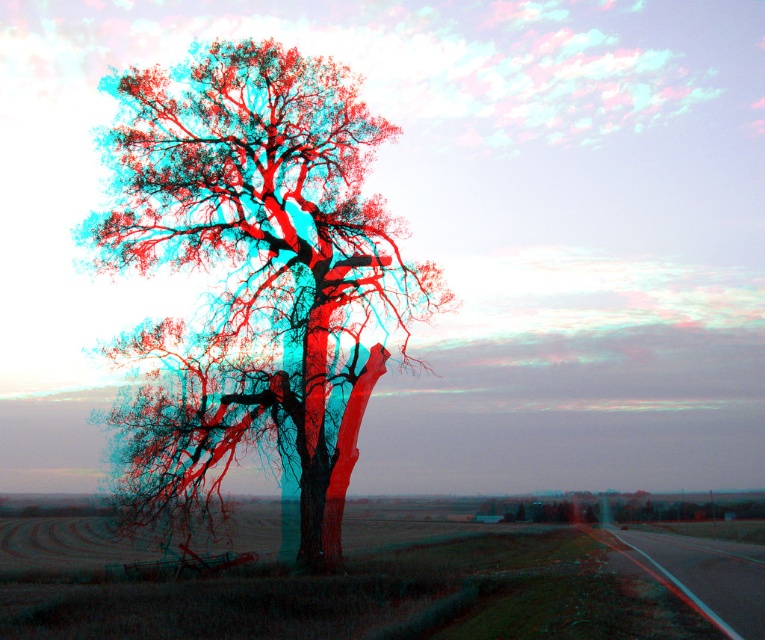
Question: Which point appears farthest from the camera in this image?

Choices:
 (A) pos(757,586)
 (B) pos(330,532)

Answer: (B)

Question: Where is smooth bark tree at center located in relation to black asphalt highway at lower right in the image?

Choices:
 (A) right
 (B) left

Answer: (B)

Question: Which of the following is the closest to the observer?

Choices:
 (A) smooth bark tree at center
 (B) black asphalt highway at lower right

Answer: (B)

Question: Which of the following is the farthest from the observer?

Choices:
 (A) (754, 557)
 (B) (161, 224)

Answer: (B)

Question: Can you confirm if smooth bark tree at center is wider than black asphalt highway at lower right?

Choices:
 (A) no
 (B) yes

Answer: (B)

Question: Does smooth bark tree at center come behind black asphalt highway at lower right?

Choices:
 (A) no
 (B) yes

Answer: (B)